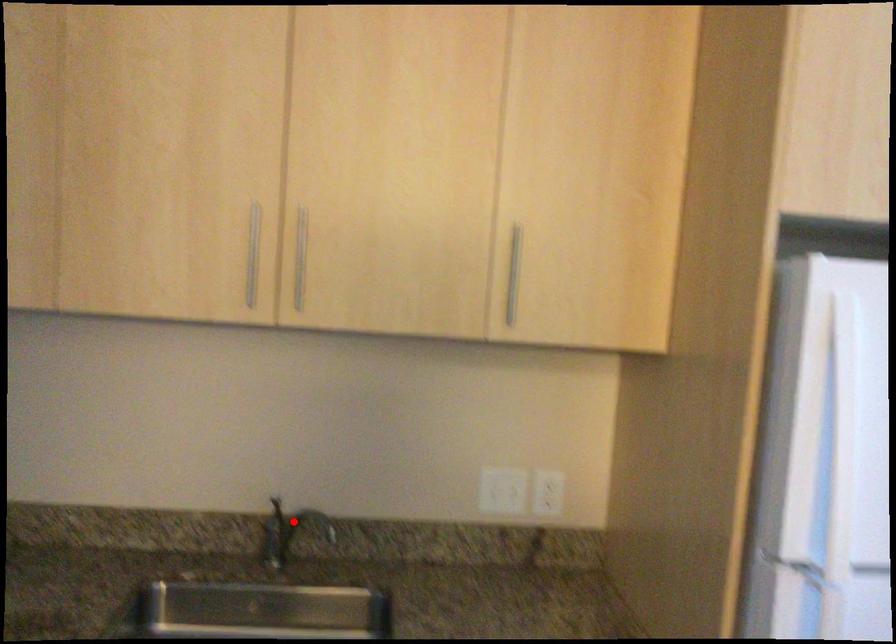
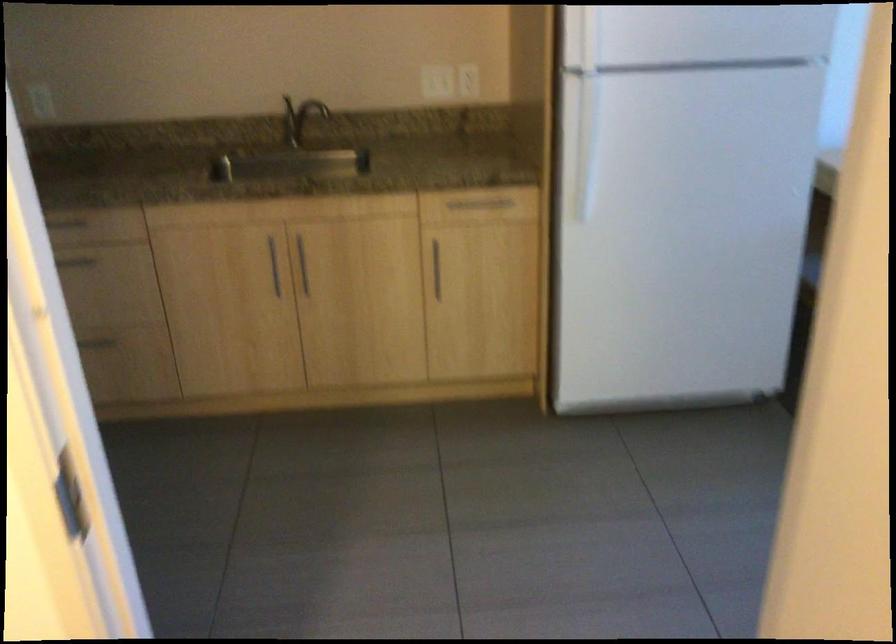
Question: I am providing you with two images of the same scene from different viewpoints. Image1 has a red point marked. In image2, the corresponding 3D location appears at what relative position? Reply with the corresponding letter.

Choices:
 (A) Closer
 (B) Farther

Answer: (B)